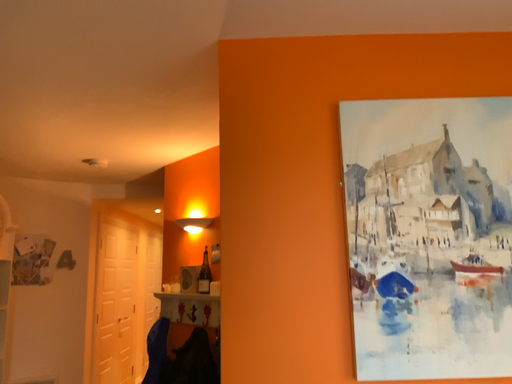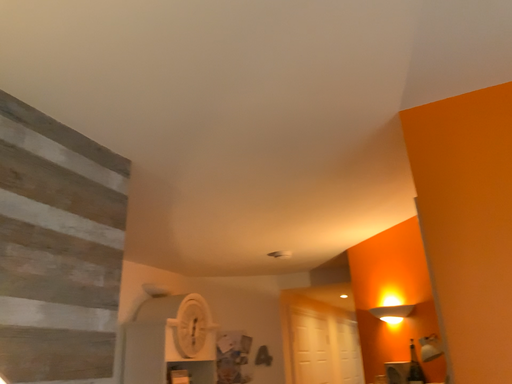
Question: Which way did the camera rotate in the video?

Choices:
 (A) rotated right
 (B) rotated left

Answer: (B)